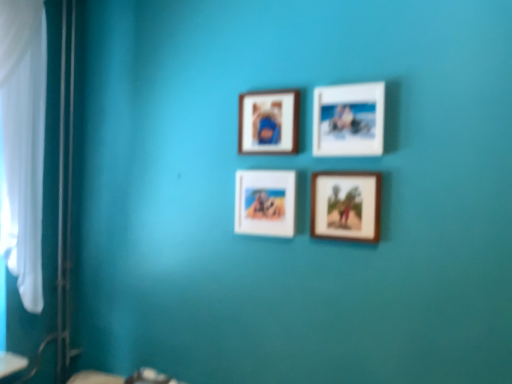
Question: Which direction should I rotate to look at white matte picture frame at upper center, which is the 1th picture frame from right to left?

Choices:
 (A) right
 (B) left

Answer: (A)

Question: Considering the relative sizes of wooden frame at upper center, the second picture frame positioned from the left, and matte wooden picture frame at center, which ranks as the 4th picture frame in right-to-left order, in the image provided, is wooden frame at upper center, the second picture frame positioned from the left, thinner than matte wooden picture frame at center, which ranks as the 4th picture frame in right-to-left order,?

Choices:
 (A) no
 (B) yes

Answer: (B)

Question: Is the depth of wooden frame at upper center, the second picture frame positioned from the left, less than that of matte wooden picture frame at center, which ranks as the first picture frame in left-to-right order?

Choices:
 (A) yes
 (B) no

Answer: (B)

Question: Considering the relative sizes of wooden frame at upper center, arranged as the 3th picture frame when viewed from the right, and matte wooden picture frame at center, which ranks as the 4th picture frame in right-to-left order, in the image provided, is wooden frame at upper center, arranged as the 3th picture frame when viewed from the right, taller than matte wooden picture frame at center, which ranks as the 4th picture frame in right-to-left order,?

Choices:
 (A) no
 (B) yes

Answer: (A)

Question: Would you say wooden frame at upper center, the second picture frame positioned from the left, is outside matte wooden picture frame at center, which ranks as the first picture frame in left-to-right order?

Choices:
 (A) yes
 (B) no

Answer: (A)

Question: Can you confirm if wooden frame at upper center, the second picture frame positioned from the left, is wider than matte wooden picture frame at center, which ranks as the first picture frame in left-to-right order?

Choices:
 (A) yes
 (B) no

Answer: (B)

Question: From the image's perspective, is wooden frame at upper center, the second picture frame positioned from the left, beneath matte wooden picture frame at center, which ranks as the 4th picture frame in right-to-left order?

Choices:
 (A) no
 (B) yes

Answer: (A)

Question: Is matte wooden picture frame at center, which ranks as the first picture frame in left-to-right order, closer to camera compared to wooden frame at upper center, the second picture frame positioned from the left?

Choices:
 (A) yes
 (B) no

Answer: (A)

Question: Is matte wooden picture frame at center, which ranks as the 4th picture frame in right-to-left order, to the left of wooden frame at upper center, the second picture frame positioned from the left, from the viewer's perspective?

Choices:
 (A) yes
 (B) no

Answer: (A)

Question: Can you confirm if matte wooden picture frame at center, which ranks as the 4th picture frame in right-to-left order, is taller than wooden frame at upper center, the second picture frame positioned from the left?

Choices:
 (A) yes
 (B) no

Answer: (A)

Question: Is matte wooden picture frame at center, which ranks as the 4th picture frame in right-to-left order, oriented away from wooden frame at upper center, the second picture frame positioned from the left?

Choices:
 (A) yes
 (B) no

Answer: (B)

Question: Is matte wooden picture frame at center, which ranks as the first picture frame in left-to-right order, facing towards wooden frame at upper center, arranged as the 3th picture frame when viewed from the right?

Choices:
 (A) yes
 (B) no

Answer: (B)

Question: From a real-world perspective, is matte wooden picture frame at center, which ranks as the 4th picture frame in right-to-left order, located higher than wooden frame at upper center, the second picture frame positioned from the left?

Choices:
 (A) yes
 (B) no

Answer: (B)

Question: Does wooden frame at upper center, arranged as the 3th picture frame when viewed from the right, have a greater width compared to white matte picture frame at upper center, which is the 1th picture frame from right to left?

Choices:
 (A) yes
 (B) no

Answer: (B)